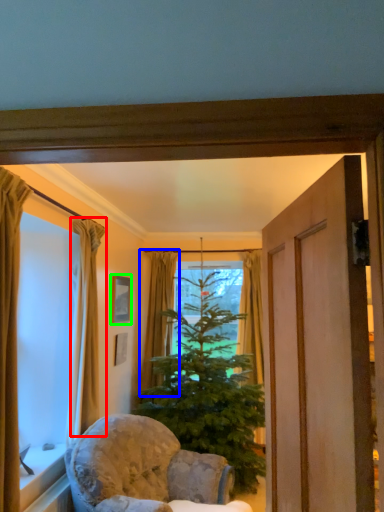
Question: Which is farther away from curtain (highlighted by a red box)? curtain (highlighted by a blue box) or picture frame (highlighted by a green box)?

Choices:
 (A) curtain
 (B) picture frame

Answer: (A)